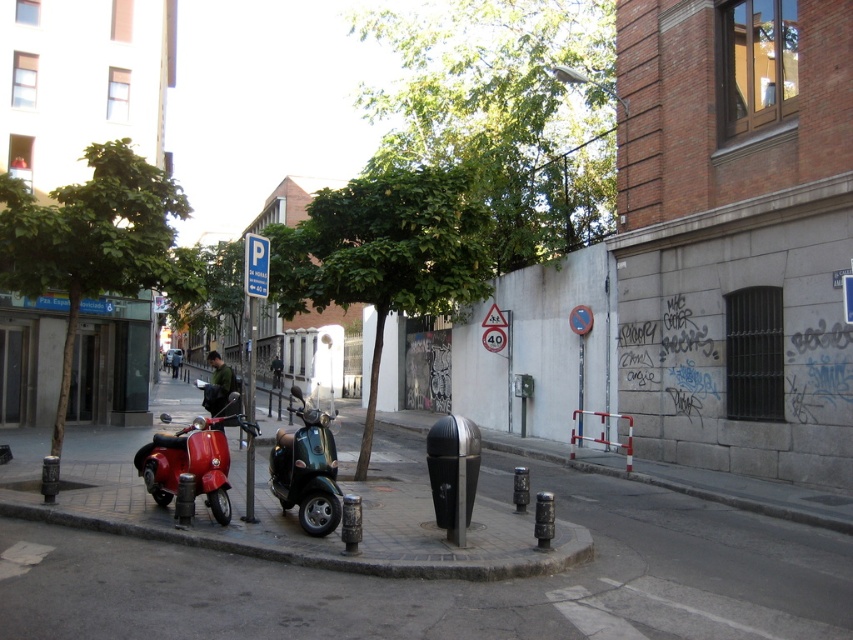
Consider the image. Between green leafy tree at upper center and green leafy tree at left, which one has less height?

With less height is green leafy tree at left.

Can you confirm if green leafy tree at upper center is positioned below green leafy tree at left?

No.

Is point (397, 106) farther from viewer compared to point (44, 282)?

That is True.

At what (x,y) coordinates should I click in order to perform the action: click on green leafy tree at upper center. Please return your answer as a coordinate pair (x, y). Looking at the image, I should click on (506, 113).

Between green leafy tree at left and shiny red scooter at lower left, which one has less height?

Standing shorter between the two is green leafy tree at left.

Between point (173, 189) and point (207, 442), which one is positioned in front?

Point (207, 442)

The image size is (853, 640). I want to click on green leafy tree at left, so click(x=96, y=243).

Does green leafy tree at upper center appear under green leafy tree at center?

No, green leafy tree at upper center is not below green leafy tree at center.

Does green leafy tree at upper center have a greater width compared to green leafy tree at center?

Correct, the width of green leafy tree at upper center exceeds that of green leafy tree at center.

Is point (537, 179) farther from camera compared to point (328, 262)?

Yes, it is behind point (328, 262).

Find the location of `green leafy tree at upper center`. green leafy tree at upper center is located at coordinates (506, 113).